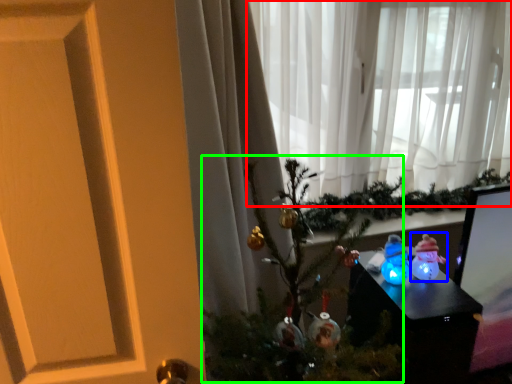
Question: Which object is positioned closest to curtain (highlighted by a red box)? Select from toy (highlighted by a blue box) and christmas tree (highlighted by a green box).

Choices:
 (A) toy
 (B) christmas tree

Answer: (B)